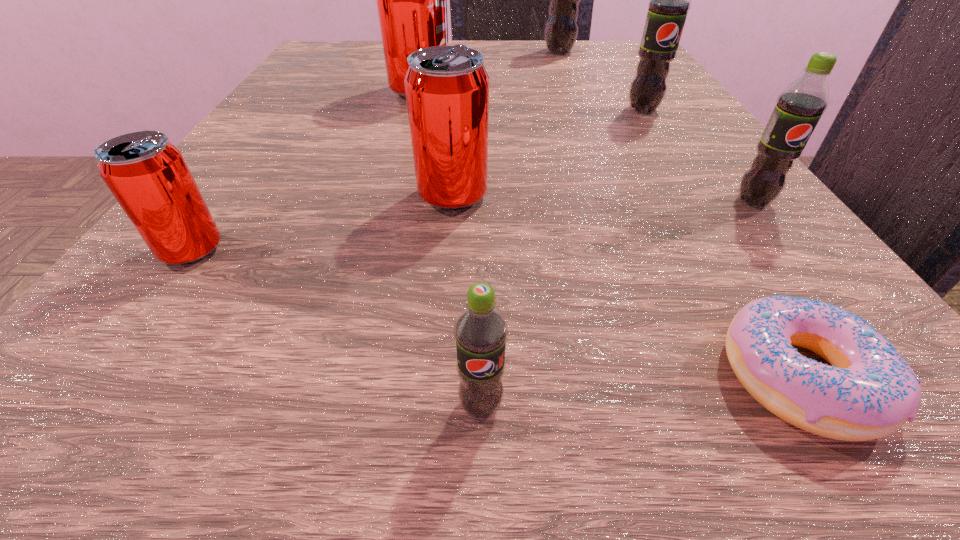
Where is `vacant area situated 0.340m on the left of the doughnut`? The image size is (960, 540). vacant area situated 0.340m on the left of the doughnut is located at coordinates (268, 377).

You are a GUI agent. You are given a task and a screenshot of the screen. Output one action in this format:
    pyautogui.click(x=<x>, y=<y>)
    Task: Click on the soda present at the near edge
    
    Given the screenshot: What is the action you would take?
    pyautogui.click(x=480, y=330)

Image resolution: width=960 pixels, height=540 pixels. What are the coordinates of `doughnut that is positioned at the near edge` in the screenshot? It's located at (869, 392).

Where is `object situated at the left edge`? This screenshot has height=540, width=960. object situated at the left edge is located at coordinates (147, 174).

Identify the location of doughnut that is positioned at the right edge. (869, 392).

Locate an element on the screen. This screenshot has width=960, height=540. object that is at the far right corner is located at coordinates (561, 30).

In order to click on object that is at the near right corner in this screenshot , I will do `click(869, 392)`.

Find the location of a particular element. The height and width of the screenshot is (540, 960). free space at the far edge is located at coordinates (560, 65).

The height and width of the screenshot is (540, 960). What are the coordinates of `blank space at the left edge of the desktop` in the screenshot? It's located at (319, 91).

In the image, there is a desktop. Identify the location of vacant area at the right edge. (704, 171).